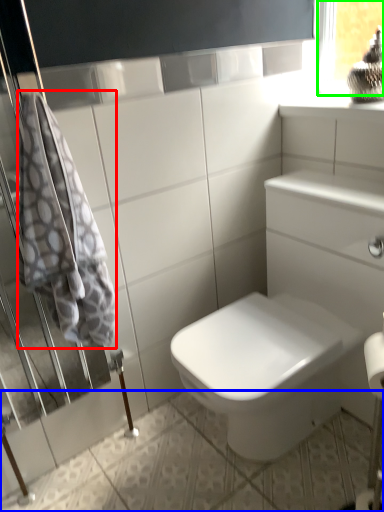
Question: Which object is positioned closest to bath towel (highlighted by a red box)? Select from ceramic tile (highlighted by a blue box) and window frame (highlighted by a green box).

Choices:
 (A) ceramic tile
 (B) window frame

Answer: (A)